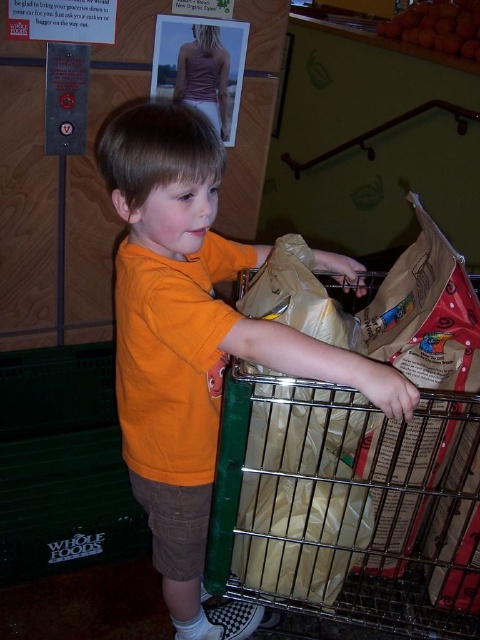
Question: Is the position of orange cotton shirt at center less distant than that of metallic silver shopping cart at center?

Choices:
 (A) yes
 (B) no

Answer: (A)

Question: Which of the following is the farthest from the observer?

Choices:
 (A) orange cotton shirt at center
 (B) metallic silver shopping cart at center

Answer: (B)

Question: Where is orange cotton shirt at center located in relation to metallic silver shopping cart at center in the image?

Choices:
 (A) below
 (B) above

Answer: (B)

Question: Which object is farther from the camera taking this photo?

Choices:
 (A) orange cotton shirt at center
 (B) metallic silver shopping cart at center

Answer: (B)

Question: Does orange cotton shirt at center have a larger size compared to metallic silver shopping cart at center?

Choices:
 (A) yes
 (B) no

Answer: (A)